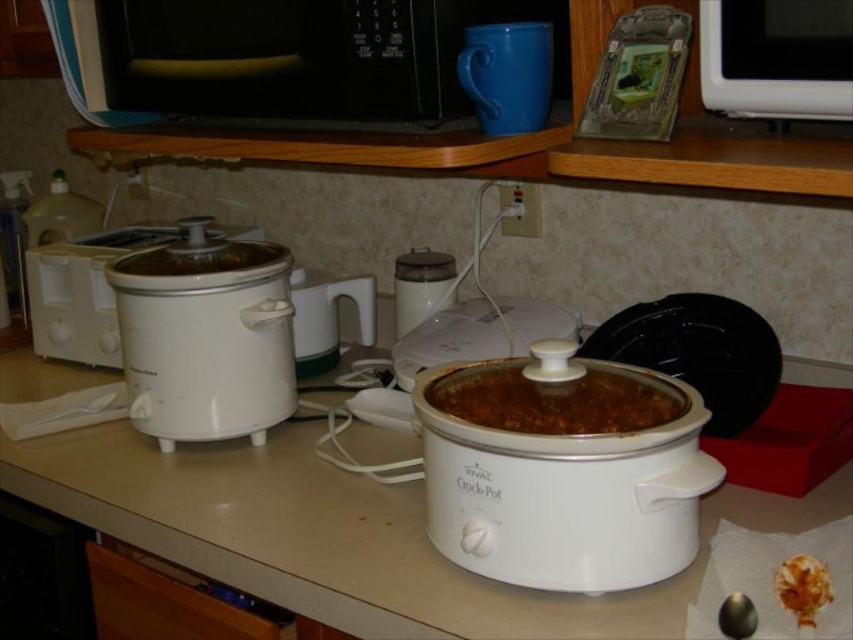
Describe the element at coordinates (561, 468) in the screenshot. I see `white matte crock-pot at center` at that location.

Who is more forward, (x=642, y=579) or (x=138, y=228)?

Point (x=642, y=579) is in front.

Locate an element on the screen. white matte crock-pot at center is located at coordinates (561, 468).

Can you confirm if white matte crock-pot at center is wider than white matte slow cooker at left?

Indeed, white matte crock-pot at center has a greater width compared to white matte slow cooker at left.

You are a GUI agent. You are given a task and a screenshot of the screen. Output one action in this format:
    pyautogui.click(x=<x>, y=<y>)
    Task: Click on the white matte crock-pot at center
    
    Given the screenshot: What is the action you would take?
    pyautogui.click(x=561, y=468)

The width and height of the screenshot is (853, 640). Identify the location of white matte crock-pot at center. (561, 468).

Does white plastic countertop at center have a smaller size compared to black plastic microwave at upper center?

Actually, white plastic countertop at center might be larger than black plastic microwave at upper center.

Can you confirm if white plastic countertop at center is wider than black plastic microwave at upper center?

Yes, white plastic countertop at center is wider than black plastic microwave at upper center.

Is point (653, 600) less distant than point (314, 24)?

Yes.

Locate an element on the screen. The width and height of the screenshot is (853, 640). white plastic countertop at center is located at coordinates (346, 534).